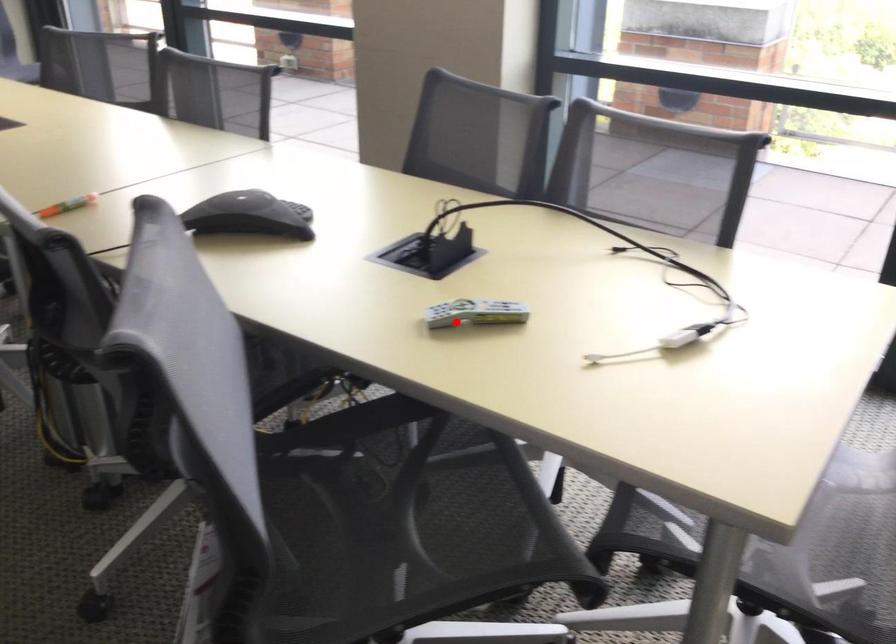
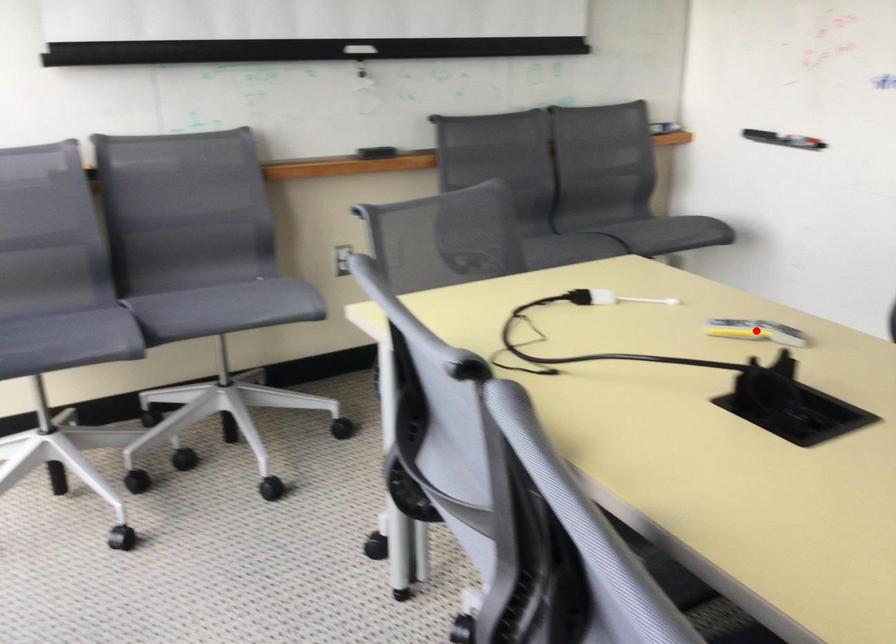
I am providing you with two images of the same scene from different viewpoints. A red point is marked on the first image and another point is marked on the second image. Does the point marked in image1 correspond to the same location as the one in image2?

Yes